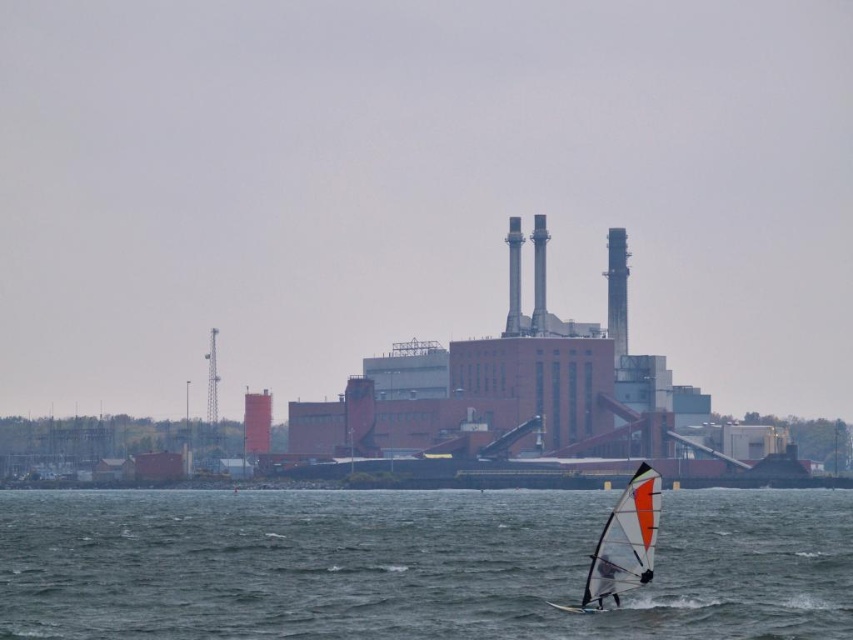
You are a drone operator trying to capture the windsurfer in the foreground. Your drone is currently hovering at point (413, 564). What do you see directly below your drone?

You see blue water at lower center directly below your drone at point (413, 564).

You are standing at the point closer to the camera between the two points, point (125, 612) and point (624, 490). Which point are you standing at?

You are standing at point (125, 612) because it is further to the camera than point (624, 490).

You are a photographer trying to capture the windsurfer in the image. Based on the scene, which object, the blue water at lower center or the white matte sail at center, appears closer to the camera?

The blue water at lower center appears closer to the camera because it is taller than the white matte sail at center, indicating it occupies more of the foreground.